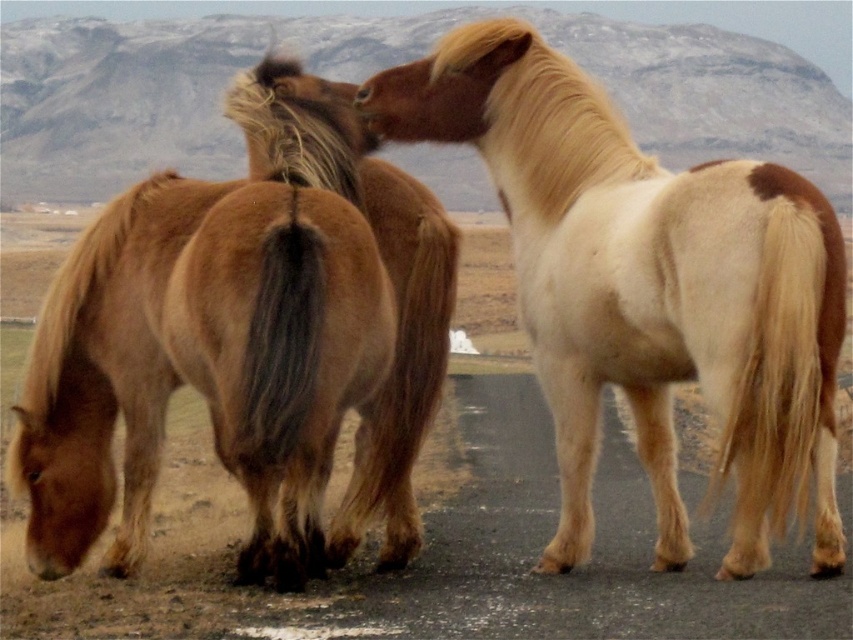
Does white-brown fur horse at center have a larger size compared to light brown fur at center?

Actually, white-brown fur horse at center might be smaller than light brown fur at center.

Describe the element at coordinates (648, 289) in the screenshot. The image size is (853, 640). I see `white-brown fur horse at center` at that location.

Where is `white-brown fur horse at center`? white-brown fur horse at center is located at coordinates (648, 289).

Does point (756, 232) come behind point (189, 333)?

No, (756, 232) is in front of (189, 333).

Does white-brown fur horse at center have a lesser height compared to brown fuzzy horse at left?

Indeed, white-brown fur horse at center has a lesser height compared to brown fuzzy horse at left.

Which is in front, point (740, 243) or point (303, 420)?

Positioned in front is point (740, 243).

At what (x,y) coordinates should I click in order to perform the action: click on white-brown fur horse at center. Please return your answer as a coordinate pair (x, y). The height and width of the screenshot is (640, 853). Looking at the image, I should click on (648, 289).

Who is lower down, brown fuzzy horse at left or brown fur at center?

brown fuzzy horse at left

Does point (115, 316) lie behind point (358, 99)?

No, it is in front of (358, 99).

Which is behind, point (175, 323) or point (357, 100)?

Point (357, 100)

Where is `brown fuzzy horse at left`? The height and width of the screenshot is (640, 853). brown fuzzy horse at left is located at coordinates (210, 346).